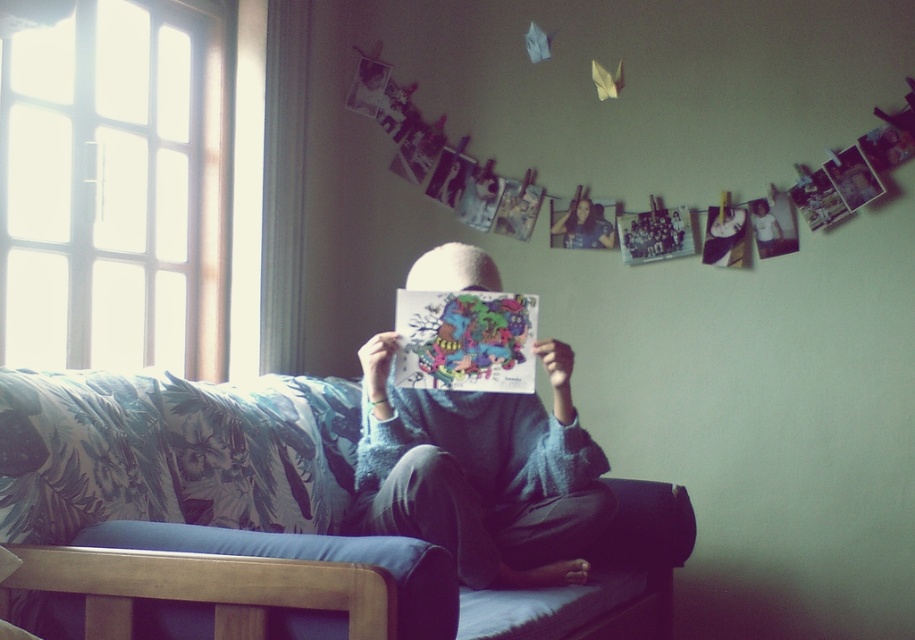
You are standing in the room and want to take a closer look at the point marked at coordinates (401, 573). If you move forward 1 meter, will you be able to reach that point?

The point at (401, 573) is 1.48 meters away from the camera. Moving forward 1 meter would bring you to 0.48 meters away, so yes, you will be able to reach that point.

You are a guest in this living room and want to sit on the blue fabric couch at center. However, you notice the blue knitted sweater at center is currently on the couch. Can you sit there without moving the sweater?

The blue fabric couch at center is bigger than the blue knitted sweater at center, so there should be enough space to sit on the couch without moving the sweater.